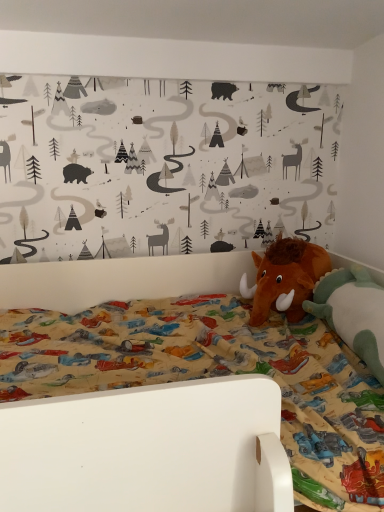
Question: Is brown plush mammoth at right, placed as the 1th toy when sorted from back to front, inside the boundaries of brown plush mammoth at right, the 1th toy from the front, or outside?

Choices:
 (A) outside
 (B) inside

Answer: (A)

Question: Relative to brown plush mammoth at right, the second toy when ordered from back to front, is brown plush mammoth at right, the 2th toy viewed from the front, in front or behind?

Choices:
 (A) front
 (B) behind

Answer: (B)

Question: In terms of height, does brown plush mammoth at right, placed as the 1th toy when sorted from back to front, look taller or shorter compared to brown plush mammoth at right, the second toy when ordered from back to front?

Choices:
 (A) short
 (B) tall

Answer: (B)

Question: Choose the correct answer: Is brown plush mammoth at right, the 1th toy from the front, inside brown plush mammoth at right, the 2th toy viewed from the front, or outside it?

Choices:
 (A) outside
 (B) inside

Answer: (A)

Question: From a real-world perspective, relative to brown plush mammoth at right, placed as the 1th toy when sorted from back to front, is brown plush mammoth at right, the second toy when ordered from back to front, vertically above or below?

Choices:
 (A) below
 (B) above

Answer: (A)

Question: Based on their sizes in the image, would you say brown plush mammoth at right, the second toy when ordered from back to front, is bigger or smaller than brown plush mammoth at right, placed as the 1th toy when sorted from back to front?

Choices:
 (A) small
 (B) big

Answer: (B)

Question: From the image's perspective, relative to brown plush mammoth at right, placed as the 1th toy when sorted from back to front, is brown plush mammoth at right, the second toy when ordered from back to front, above or below?

Choices:
 (A) below
 (B) above

Answer: (A)